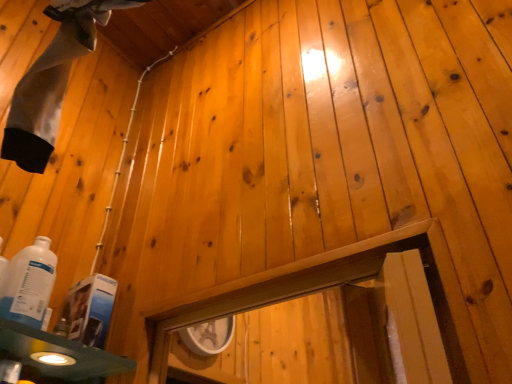
Locate an element on the screen. The width and height of the screenshot is (512, 384). white glossy bottle at lower left is located at coordinates (29, 284).

Describe the element at coordinates (29, 284) in the screenshot. Image resolution: width=512 pixels, height=384 pixels. I see `white glossy bottle at lower left` at that location.

The height and width of the screenshot is (384, 512). Find the location of `white glossy bottle at lower left`. white glossy bottle at lower left is located at coordinates (29, 284).